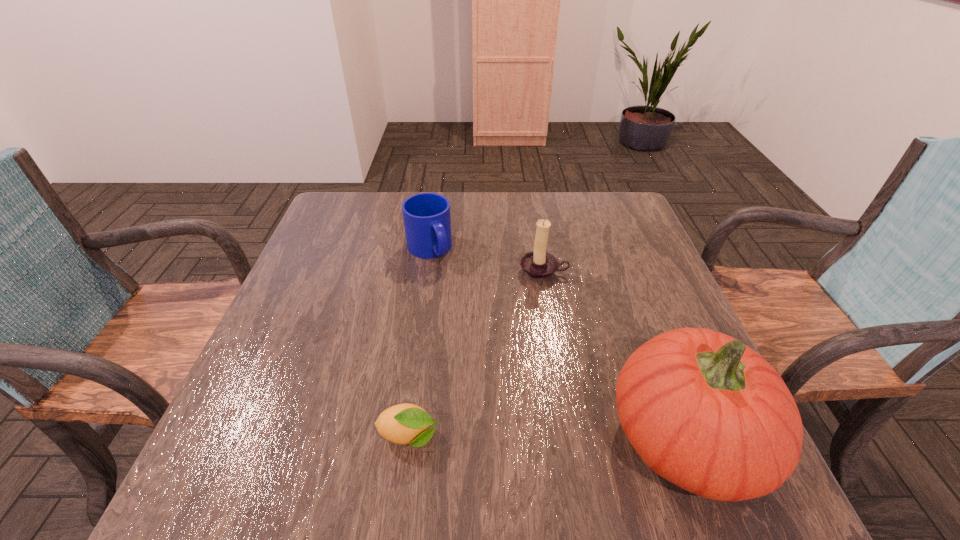
Where is `vacant space located on the side with the handle of the third tallest object`? vacant space located on the side with the handle of the third tallest object is located at coordinates (508, 374).

I want to click on vacant space located 0.270m on the wick of the third shortest object, so click(x=531, y=374).

Identify the location of free region located on the wick of the third shortest object. This screenshot has height=540, width=960. (525, 429).

Find the location of a particular element. This screenshot has width=960, height=540. vacant region located on the wick of the third shortest object is located at coordinates (538, 316).

I want to click on object present at the far edge, so click(x=427, y=221).

Image resolution: width=960 pixels, height=540 pixels. Find the location of `lemon located at the near edge`. lemon located at the near edge is located at coordinates (406, 423).

I want to click on pumpkin that is at the near edge, so pyautogui.click(x=703, y=410).

Image resolution: width=960 pixels, height=540 pixels. What are the coordinates of `object that is at the right edge` in the screenshot? It's located at (703, 410).

In order to click on object positioned at the near right corner in this screenshot , I will do `click(703, 410)`.

In the image, there is a desktop. Identify the location of free space at the far edge. This screenshot has height=540, width=960. (455, 194).